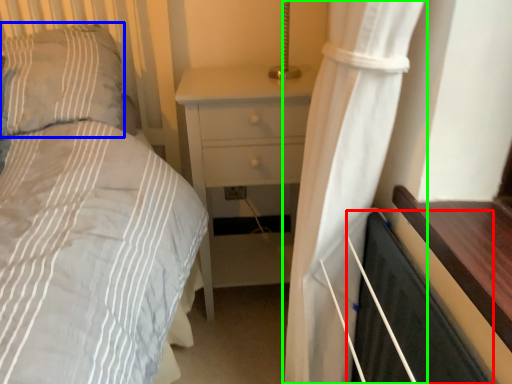
Question: Which object is positioned farthest from screen door (highlighted by a red box)? Select from pillow (highlighted by a blue box) and curtain (highlighted by a green box).

Choices:
 (A) pillow
 (B) curtain

Answer: (A)